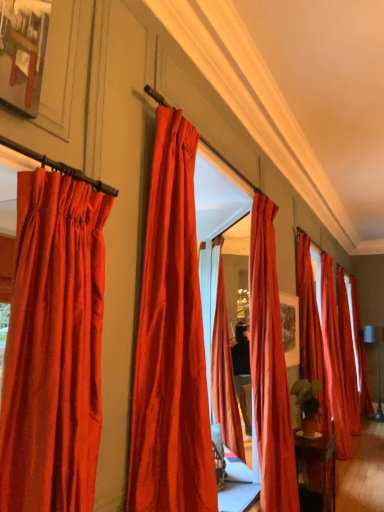
Where is `satin red curtain at center, positioned as the 3th curtain in front-to-back order`? The image size is (384, 512). satin red curtain at center, positioned as the 3th curtain in front-to-back order is located at coordinates (269, 367).

This screenshot has width=384, height=512. I want to click on satin red curtain at right, the 3th curtain positioned from the back, so click(x=334, y=360).

Is satin red curtain at center, the fifth curtain positioned from the back, at the back of satin red curtain at right, acting as the fourth curtain starting from the right?

No, satin red curtain at right, acting as the fourth curtain starting from the right, is not facing away from satin red curtain at center, the fifth curtain positioned from the back.

Are satin red curtain at right, acting as the fourth curtain starting from the right, and satin red curtain at center, which ranks as the 3th curtain in left-to-right order, beside each other?

No, satin red curtain at right, acting as the fourth curtain starting from the right, is not making contact with satin red curtain at center, which ranks as the 3th curtain in left-to-right order.

Does satin red curtain at right, the 4th curtain when ordered from front to back, appear on the left side of satin red curtain at center, the fifth curtain positioned from the back?

No, satin red curtain at right, the 4th curtain when ordered from front to back, is not to the left of satin red curtain at center, the fifth curtain positioned from the back.

Which is behind, point (319, 381) or point (266, 297)?

Point (319, 381)

Considering the relative sizes of satin red curtain at right, which is the fourth curtain from back to front, and satin red curtain at left, which is the seventh curtain from right to left, in the image provided, is satin red curtain at right, which is the fourth curtain from back to front, bigger than satin red curtain at left, which is the seventh curtain from right to left,?

Yes.

Can you confirm if satin red curtain at right, which is counted as the fourth curtain, starting from the left, is thinner than satin red curtain at left, which is the seventh curtain from right to left?

No, satin red curtain at right, which is counted as the fourth curtain, starting from the left, is not thinner than satin red curtain at left, which is the seventh curtain from right to left.

Is satin red curtain at right, which is counted as the fourth curtain, starting from the left, positioned with its back to satin red curtain at left, which appears as the first curtain when viewed from the front?

No, satin red curtain at left, which appears as the first curtain when viewed from the front, is not at the back of satin red curtain at right, which is counted as the fourth curtain, starting from the left.

Would you say satin red curtain at right, which is counted as the fourth curtain, starting from the left, is to the left or to the right of satin red curtain at left, placed as the seventh curtain when sorted from back to front, in the picture?

In the image, satin red curtain at right, which is counted as the fourth curtain, starting from the left, appears on the right side of satin red curtain at left, placed as the seventh curtain when sorted from back to front.

Considering the sizes of satin red curtain at right, marked as the fifth curtain in a front-to-back arrangement, and satin red curtain at right, acting as the fourth curtain starting from the right, in the image, is satin red curtain at right, marked as the fifth curtain in a front-to-back arrangement, wider or thinner than satin red curtain at right, acting as the fourth curtain starting from the right,?

satin red curtain at right, marked as the fifth curtain in a front-to-back arrangement, is thinner than satin red curtain at right, acting as the fourth curtain starting from the right.

From the image's perspective, is satin red curtain at right, which is counted as the 3th curtain, starting from the right, on top of satin red curtain at right, the 4th curtain when ordered from front to back?

No, from the image's perspective, satin red curtain at right, which is counted as the 3th curtain, starting from the right, is not above satin red curtain at right, the 4th curtain when ordered from front to back.

Which curtain is the 1st one when counting from the front of the satin red curtain at right, the fifth curtain from the left? Please provide its 2D coordinates.

[(311, 329)]

How many degrees apart are the facing directions of satin red curtain at right, the 3th curtain positioned from the back, and satin red curtain at right, which is counted as the fourth curtain, starting from the left?

satin red curtain at right, the 3th curtain positioned from the back, and satin red curtain at right, which is counted as the fourth curtain, starting from the left, are facing 0.00428 degrees away from each other.

Is satin red curtain at right, acting as the fourth curtain starting from the right, oriented away from satin red curtain at right, which appears as the 7th curtain when viewed from the front?

No, satin red curtain at right, acting as the fourth curtain starting from the right, is not facing the opposite direction of satin red curtain at right, which appears as the 7th curtain when viewed from the front.

Is satin red curtain at right, which appears as the 7th curtain when viewed from the front, completely or partially inside satin red curtain at right, which is the fourth curtain from back to front?

No, satin red curtain at right, which is the fourth curtain from back to front, does not contain satin red curtain at right, which appears as the 7th curtain when viewed from the front.

From a real-world perspective, who is located higher, satin red curtain at right, which is the fourth curtain from back to front, or satin red curtain at right, the first curtain from the back?

From a 3D spatial view, satin red curtain at right, the first curtain from the back, is above.

In the scene shown: Which is more to the right, satin red curtain at left, placed as the seventh curtain when sorted from back to front, or satin red curtain at center, positioned as the 3th curtain in front-to-back order?

Positioned to the right is satin red curtain at center, positioned as the 3th curtain in front-to-back order.

In terms of width, does satin red curtain at left, placed as the seventh curtain when sorted from back to front, look wider or thinner when compared to satin red curtain at center, the fifth curtain positioned from the back?

In the image, satin red curtain at left, placed as the seventh curtain when sorted from back to front, appears to be more narrow than satin red curtain at center, the fifth curtain positioned from the back.

Is satin red curtain at left, the 1th curtain in the left-to-right sequence, located outside satin red curtain at center, positioned as the 3th curtain in front-to-back order?

Indeed, satin red curtain at left, the 1th curtain in the left-to-right sequence, is completely outside satin red curtain at center, positioned as the 3th curtain in front-to-back order.

From the image's perspective, is satin red curtain at left, placed as the seventh curtain when sorted from back to front, beneath satin red curtain at center, which ranks as the 3th curtain in left-to-right order?

Incorrect, from the image's perspective, satin red curtain at left, placed as the seventh curtain when sorted from back to front, is higher than satin red curtain at center, which ranks as the 3th curtain in left-to-right order.

From a real-world perspective, does satin red curtain at right, which is the fourth curtain from back to front, stand above satin red curtain at center, which is the 2th curtain in left-to-right order?

Incorrect, from a real-world perspective, satin red curtain at right, which is the fourth curtain from back to front, is lower than satin red curtain at center, which is the 2th curtain in left-to-right order.

From their relative heights in the image, would you say satin red curtain at right, which is the fourth curtain from back to front, is taller or shorter than satin red curtain at center, the 2th curtain viewed from the front?

In the image, satin red curtain at right, which is the fourth curtain from back to front, appears to be taller than satin red curtain at center, the 2th curtain viewed from the front.

Considering the points (307, 274) and (173, 281), which point is behind, point (307, 274) or point (173, 281)?

Positioned behind is point (307, 274).

Would you consider satin red curtain at right, which is the fourth curtain from back to front, to be distant from satin red curtain at center, which is the 2th curtain in left-to-right order?

Yes, satin red curtain at right, which is the fourth curtain from back to front, and satin red curtain at center, which is the 2th curtain in left-to-right order, are quite far apart.

From the satin red curtain at right, the 3th curtain positioned from the back, count 2nd curtains forward and point to it. Please provide its 2D coordinates.

[(269, 367)]

From a real-world perspective, is satin red curtain at right, the 3th curtain positioned from the back, physically located above or below satin red curtain at center, which appears as the fifth curtain when viewed from the right?

From a real-world perspective, satin red curtain at right, the 3th curtain positioned from the back, is physically below satin red curtain at center, which appears as the fifth curtain when viewed from the right.

From the image's perspective, between satin red curtain at right, the 3th curtain positioned from the back, and satin red curtain at center, positioned as the 3th curtain in front-to-back order, which one is located above?

satin red curtain at center, positioned as the 3th curtain in front-to-back order, is shown above in the image.

Considering the positions of objects satin red curtain at right, which is counted as the 3th curtain, starting from the right, and satin red curtain at center, which ranks as the 3th curtain in left-to-right order, in the image provided, who is more to the left, satin red curtain at right, which is counted as the 3th curtain, starting from the right, or satin red curtain at center, which ranks as the 3th curtain in left-to-right order,?

satin red curtain at center, which ranks as the 3th curtain in left-to-right order.

The image size is (384, 512). In order to click on the 1st curtain to the left of the satin red curtain at right, which is counted as the fourth curtain, starting from the left, starting your count from the anchor in this screenshot , I will do `click(269, 367)`.

From a real-world perspective, count 3rd curtains upward from the satin red curtain at right, the 4th curtain when ordered from front to back, and point to it. Please provide its 2D coordinates.

[(54, 348)]

Estimate the real-world distances between objects in this image. Which object is closer to satin red curtain at center, which is the sixth curtain in right-to-left order, satin red curtain at right, which appears as the 7th curtain when viewed from the front, or satin red curtain at right, marked as the sixth curtain in a left-to-right arrangement?

The object closer to satin red curtain at center, which is the sixth curtain in right-to-left order, is satin red curtain at right, marked as the sixth curtain in a left-to-right arrangement.

From the image, which object appears to be farther from satin red curtain at right, marked as the fifth curtain in a front-to-back arrangement, satin red curtain at right, the first curtain from the back, or satin red curtain at right, which is the fourth curtain from back to front?

satin red curtain at right, the first curtain from the back, is positioned further to the anchor satin red curtain at right, marked as the fifth curtain in a front-to-back arrangement.

Looking at the image, which one is located closer to satin red curtain at center, which is the 2th curtain in left-to-right order, satin red curtain at right, which is counted as the fourth curtain, starting from the left, or satin red curtain at left, the 1th curtain in the left-to-right sequence?

satin red curtain at left, the 1th curtain in the left-to-right sequence, is positioned closer to the anchor satin red curtain at center, which is the 2th curtain in left-to-right order.

Considering their positions, is satin red curtain at right, which is the fourth curtain from back to front, positioned further to satin red curtain at right, the 6th curtain from the front, than satin red curtain at left, which appears as the first curtain when viewed from the front?

satin red curtain at left, which appears as the first curtain when viewed from the front, lies further to satin red curtain at right, the 6th curtain from the front, than the other object.

Based on their spatial positions, is satin red curtain at right, which is counted as the 3th curtain, starting from the right, or satin red curtain at right, the 2th curtain positioned from the back, closer to satin red curtain at right, acting as the fourth curtain starting from the right?

The object closer to satin red curtain at right, acting as the fourth curtain starting from the right, is satin red curtain at right, which is counted as the 3th curtain, starting from the right.

Estimate the real-world distances between objects in this image. Which object is closer to satin red curtain at right, which appears as the 7th curtain when viewed from the front, satin red curtain at center, the 6th curtain when ordered from back to front, or satin red curtain at right, which is counted as the fourth curtain, starting from the left?

satin red curtain at right, which is counted as the fourth curtain, starting from the left, is closer to satin red curtain at right, which appears as the 7th curtain when viewed from the front.

Based on their spatial positions, is satin red curtain at right, the 3th curtain positioned from the back, or satin red curtain at center, which is the 2th curtain in left-to-right order, closer to satin red curtain at left, which appears as the first curtain when viewed from the front?

satin red curtain at center, which is the 2th curtain in left-to-right order, is positioned closer to the anchor satin red curtain at left, which appears as the first curtain when viewed from the front.

Which object lies further to the anchor point satin red curtain at right, the fifth curtain from the left, satin red curtain at right, marked as the sixth curtain in a left-to-right arrangement, or satin red curtain at right, which is counted as the 7th curtain, starting from the left?

satin red curtain at right, which is counted as the 7th curtain, starting from the left, is further to satin red curtain at right, the fifth curtain from the left.

This screenshot has width=384, height=512. Identify the location of curtain between satin red curtain at center, the 2th curtain viewed from the front, and satin red curtain at right, which is counted as the fourth curtain, starting from the left, along the z-axis. (269, 367).

This screenshot has height=512, width=384. I want to click on curtain located between satin red curtain at right, which is counted as the fourth curtain, starting from the left, and satin red curtain at right, the 6th curtain from the front, in the depth direction, so tap(334, 360).

At what (x,y) coordinates should I click in order to perform the action: click on curtain between satin red curtain at right, which is counted as the 3th curtain, starting from the right, and satin red curtain at right, positioned as the first curtain in right-to-left order, in the front-back direction. Please return your answer as a coordinate pair (x, y). This screenshot has width=384, height=512. Looking at the image, I should click on (347, 354).

This screenshot has height=512, width=384. Identify the location of curtain between satin red curtain at left, which is the seventh curtain from right to left, and satin red curtain at center, the fifth curtain positioned from the back, from front to back. (171, 342).